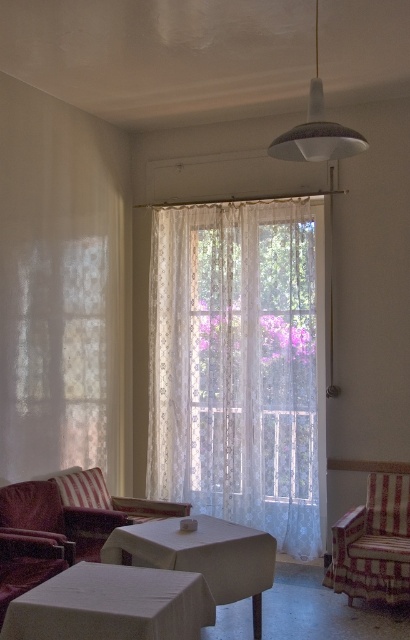
Can you confirm if white cloth-covered table at lower center is thinner than striped fabric pillow at lower left?

In fact, white cloth-covered table at lower center might be wider than striped fabric pillow at lower left.

How much distance is there between white cloth-covered table at lower center and striped fabric pillow at lower left?

white cloth-covered table at lower center is 4.87 feet away from striped fabric pillow at lower left.

Image resolution: width=410 pixels, height=640 pixels. I want to click on white cloth-covered table at lower center, so click(x=111, y=605).

This screenshot has height=640, width=410. Find the location of `white cloth-covered table at lower center`. white cloth-covered table at lower center is located at coordinates (111, 605).

Can you confirm if striped fabric armchair at lower right is bigger than white matte lampshade at upper center?

Yes, striped fabric armchair at lower right is bigger than white matte lampshade at upper center.

Does striped fabric armchair at lower right appear under white matte lampshade at upper center?

Indeed, striped fabric armchair at lower right is positioned under white matte lampshade at upper center.

In order to click on striped fabric armchair at lower right in this screenshot , I will do `click(373, 544)`.

Between white lace curtain at center and white cloth-covered table at lower center, which one appears on the right side from the viewer's perspective?

Positioned to the right is white lace curtain at center.

Which is below, white lace curtain at center or white cloth-covered table at lower center?

white cloth-covered table at lower center is lower down.

Is point (234, 257) positioned in front of point (24, 627)?

No.

The width and height of the screenshot is (410, 640). Identify the location of white lace curtain at center. (236, 365).